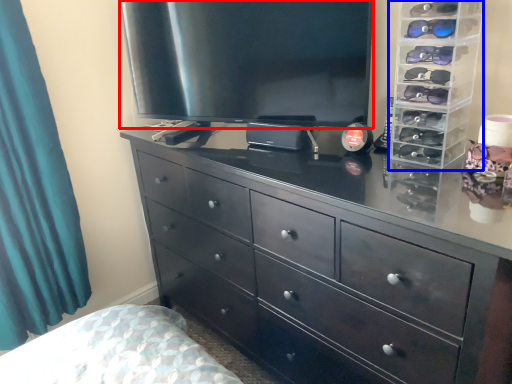
Question: Among these objects, which one is farthest to the camera, television (highlighted by a red box) or tv cabinet (highlighted by a blue box)?

Choices:
 (A) television
 (B) tv cabinet

Answer: (A)